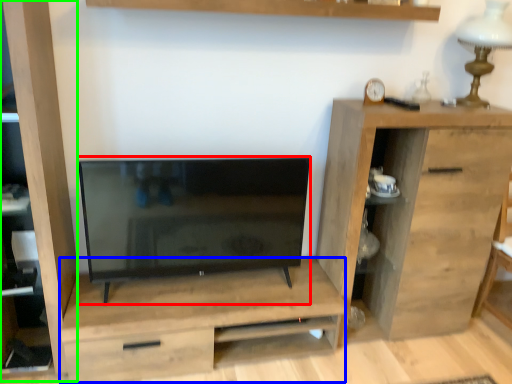
Question: Which object is the closest to the television (highlighted by a red box)? Choose among these: dresser (highlighted by a blue box) or cabinet (highlighted by a green box).

Choices:
 (A) dresser
 (B) cabinet

Answer: (A)